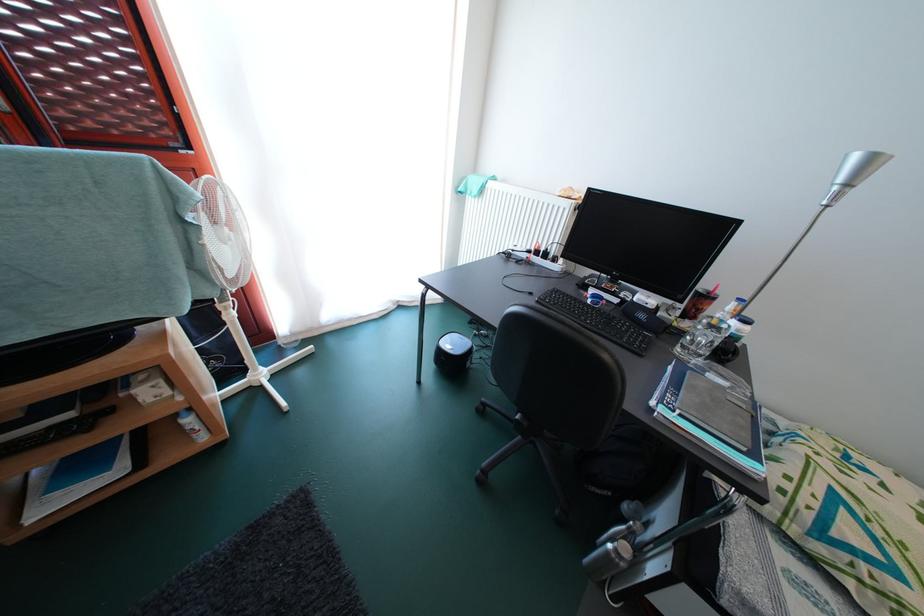
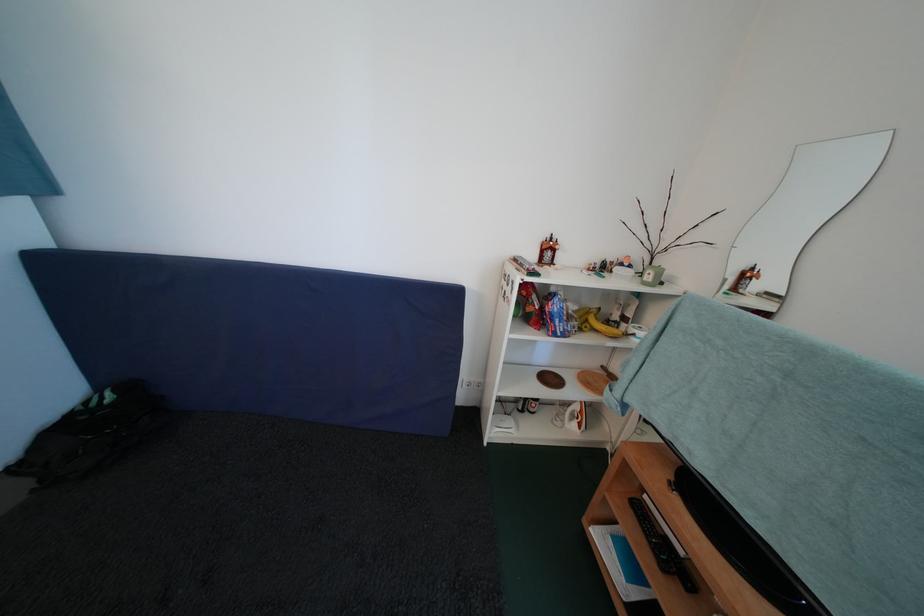
The point at (96,435) is marked in the first image. Where is the corresponding point in the second image?

(671, 573)